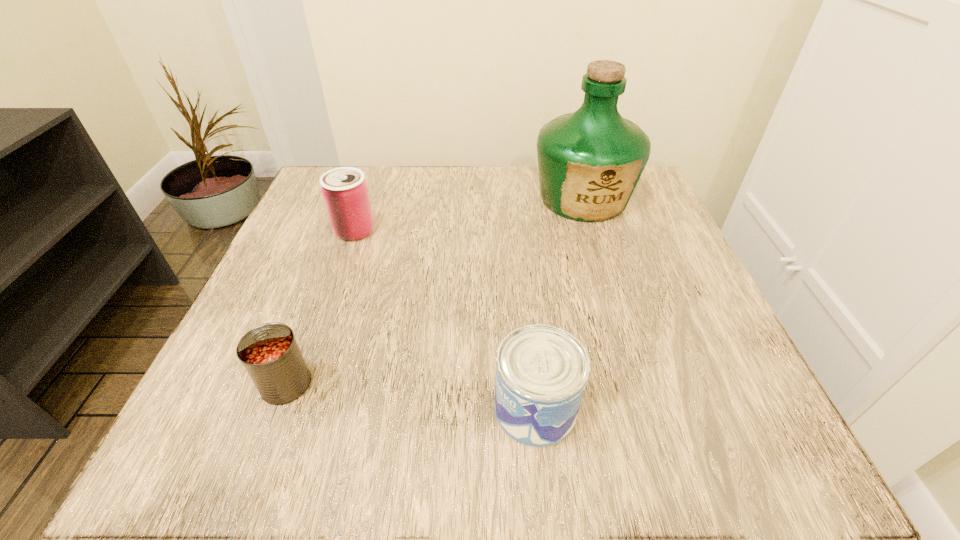
At what (x,y) coordinates should I click in order to perform the action: click on can that stands as the second closest to the rightmost can. Please return your answer as a coordinate pair (x, y). The width and height of the screenshot is (960, 540). Looking at the image, I should click on (345, 192).

Identify which can is located as the second nearest to the rightmost can. Please provide its 2D coordinates. Your answer should be formatted as a tuple, i.e. [(x, y)], where the tuple contains the x and y coordinates of a point satisfying the conditions above.

[(345, 192)]